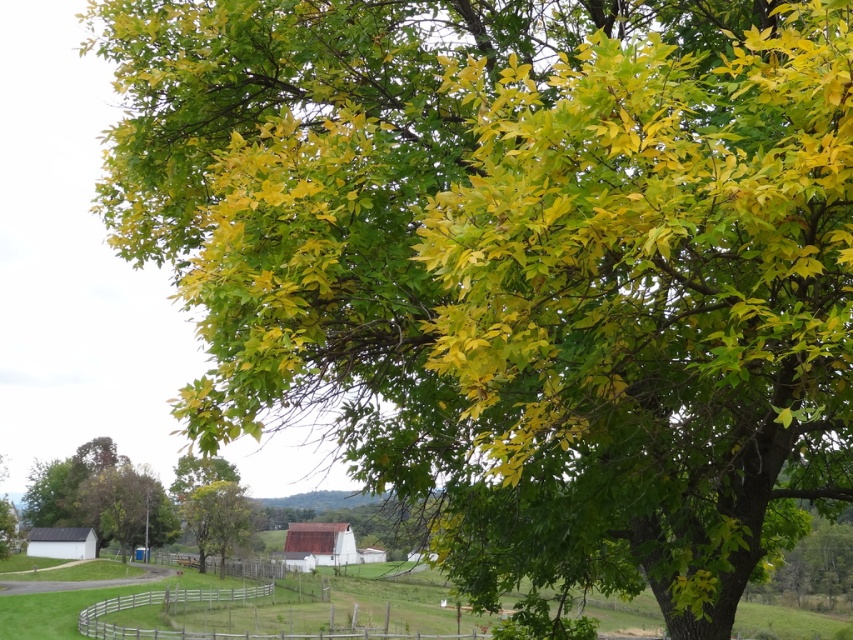
Which is above, brown wooden fence at lower center or wooden at lower center?

brown wooden fence at lower center

Which is behind, point (225, 595) or point (282, 566)?

Point (282, 566)

At what (x,y) coordinates should I click in order to perform the action: click on brown wooden fence at lower center. Please return your answer as a coordinate pair (x, y). Looking at the image, I should click on (163, 602).

Does green leafy tree at center have a lesser width compared to wooden at lower center?

Yes, green leafy tree at center is thinner than wooden at lower center.

In order to click on green leafy tree at center in this screenshot , I will do `click(216, 518)`.

Can you confirm if green leafy tree at center is taller than brown wooden fence at lower center?

In fact, green leafy tree at center may be shorter than brown wooden fence at lower center.

Is green leafy tree at center to the left of brown wooden fence at lower center from the viewer's perspective?

Correct, you'll find green leafy tree at center to the left of brown wooden fence at lower center.

Is point (227, 515) closer to viewer compared to point (479, 634)?

No, (227, 515) is further to viewer.

Locate an element on the screen. green leafy tree at center is located at coordinates (x=216, y=518).